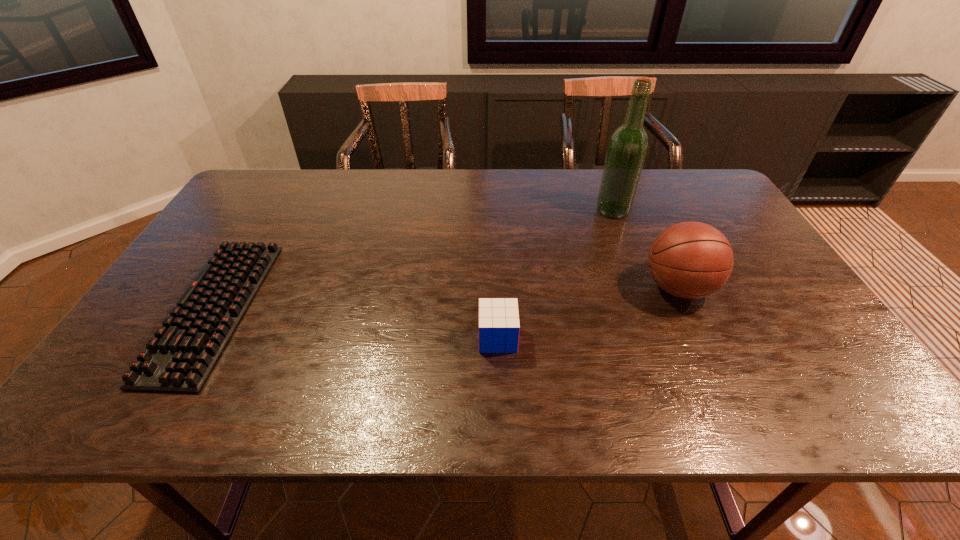
Locate an element on the screen. The width and height of the screenshot is (960, 540). free spot between the third shortest object and the tallest object is located at coordinates tap(645, 249).

At what (x,y) coordinates should I click in order to perform the action: click on blank region between the third tallest object and the farthest object. Please return your answer as a coordinate pair (x, y). The image size is (960, 540). Looking at the image, I should click on pyautogui.click(x=555, y=274).

Locate an element on the screen. The image size is (960, 540). vacant space that is in between the basketball and the shortest object is located at coordinates (446, 299).

Where is `free spot between the computer keyboard and the liquor`? This screenshot has height=540, width=960. free spot between the computer keyboard and the liquor is located at coordinates (414, 260).

This screenshot has height=540, width=960. Identify the location of blank region between the second shortest object and the basketball. (588, 313).

The height and width of the screenshot is (540, 960). Find the location of `free space between the basketball and the computer keyboard`. free space between the basketball and the computer keyboard is located at coordinates (446, 299).

Locate an element on the screen. This screenshot has width=960, height=540. empty space between the cube and the farthest object is located at coordinates (555, 274).

At what (x,y) coordinates should I click in order to perform the action: click on free space between the cube and the liquor. Please return your answer as a coordinate pair (x, y). Looking at the image, I should click on (555, 274).

I want to click on free spot between the farthest object and the shortest object, so click(x=414, y=260).

Find the location of `vacant area between the shortest object and the liquor`. vacant area between the shortest object and the liquor is located at coordinates (414, 260).